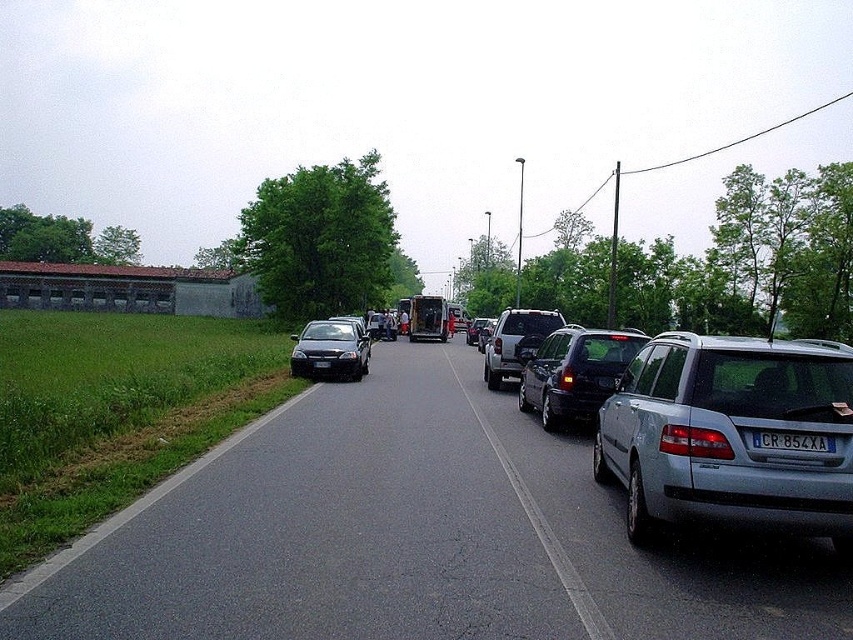
You are a pedestrian standing on the grassy area on the left side of the road. You need to cross the road to reach the trees on the other side. Which vehicle, the silver metallic station wagon at right or the satin silver suv at center, should you wait behind to ensure you are visible to oncoming traffic?

You should wait behind the satin silver suv at center because the silver metallic station wagon at right is closer to the viewer, meaning the suv is farther away and provides a better vantage point for visibility.

You are a drone pilot trying to capture aerial footage of the traffic jam. You notice two points marked on your map at coordinates point (627, 506) and point (595, 346). Which point should you prioritize to get a better view of the entire traffic jam?

Point (627, 506) is closer to the camera than point (595, 346), so prioritizing point (627, 506) will provide a better view of the entire traffic jam as it is nearer and allows for a wider perspective.